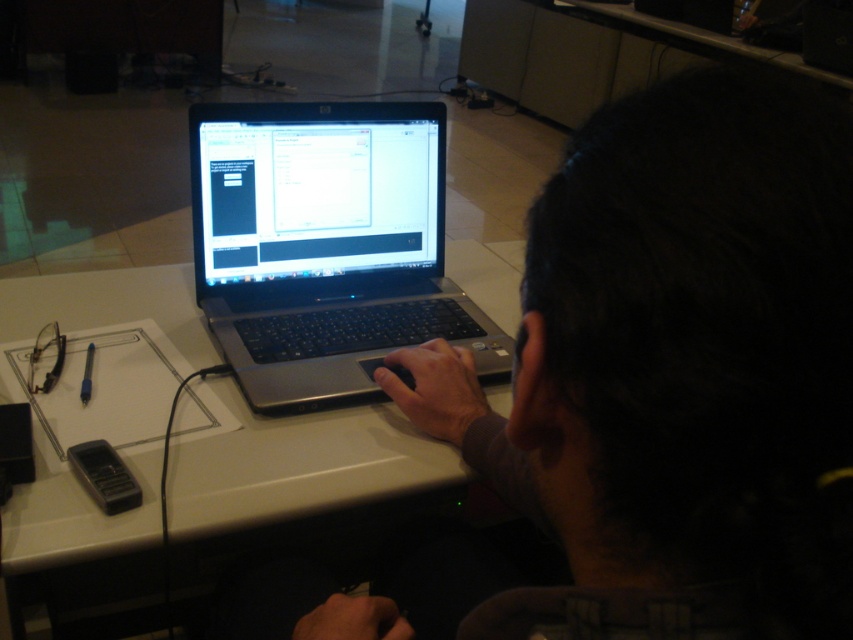
Question: Among these points, which one is farthest from the camera?

Choices:
 (A) (256, 157)
 (B) (115, 497)

Answer: (A)

Question: Can you confirm if silver/black plastic laptop at center is wider than black plastic phone at lower left?

Choices:
 (A) yes
 (B) no

Answer: (A)

Question: Can you confirm if dark matte laptop at center is positioned to the right of silver/black plastic laptop at center?

Choices:
 (A) no
 (B) yes

Answer: (B)

Question: Among these objects, which one is farthest from the camera?

Choices:
 (A) white glossy table at center
 (B) black plastic phone at lower left
 (C) dark matte laptop at center

Answer: (B)

Question: Which object is closer to the camera taking this photo?

Choices:
 (A) silver/black plastic laptop at center
 (B) white glossy table at center

Answer: (B)

Question: Is dark matte laptop at center positioned behind white glossy table at center?

Choices:
 (A) no
 (B) yes

Answer: (A)